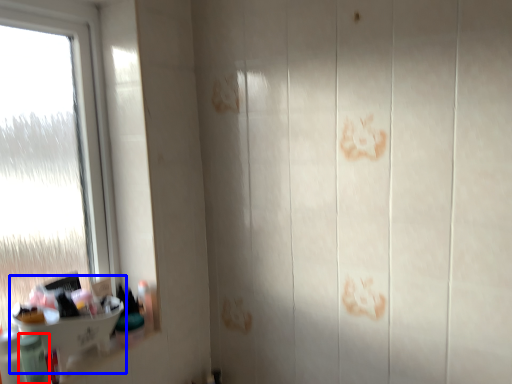
Question: Among these objects, which one is farthest to the camera, toiletry (highlighted by a red box) or sink (highlighted by a blue box)?

Choices:
 (A) toiletry
 (B) sink

Answer: (B)